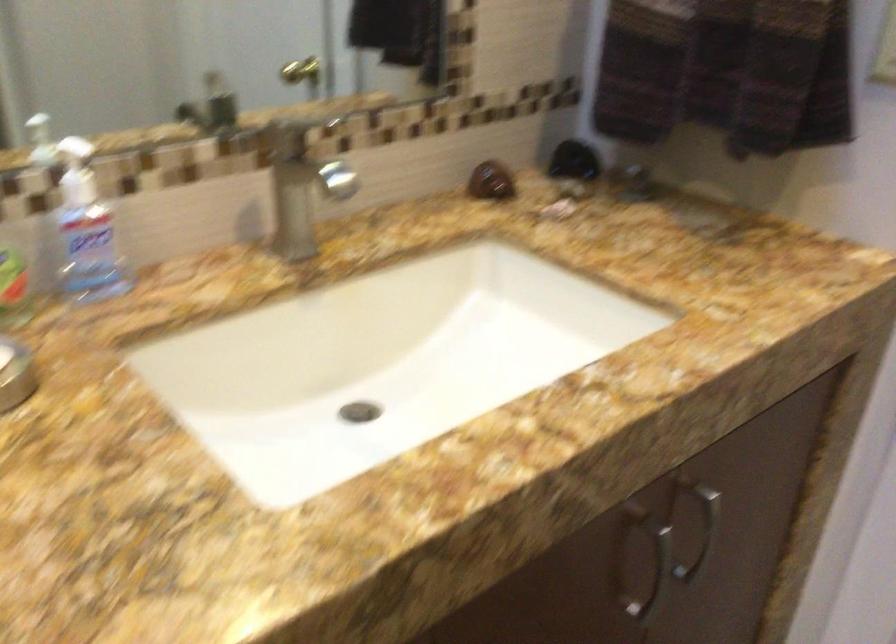
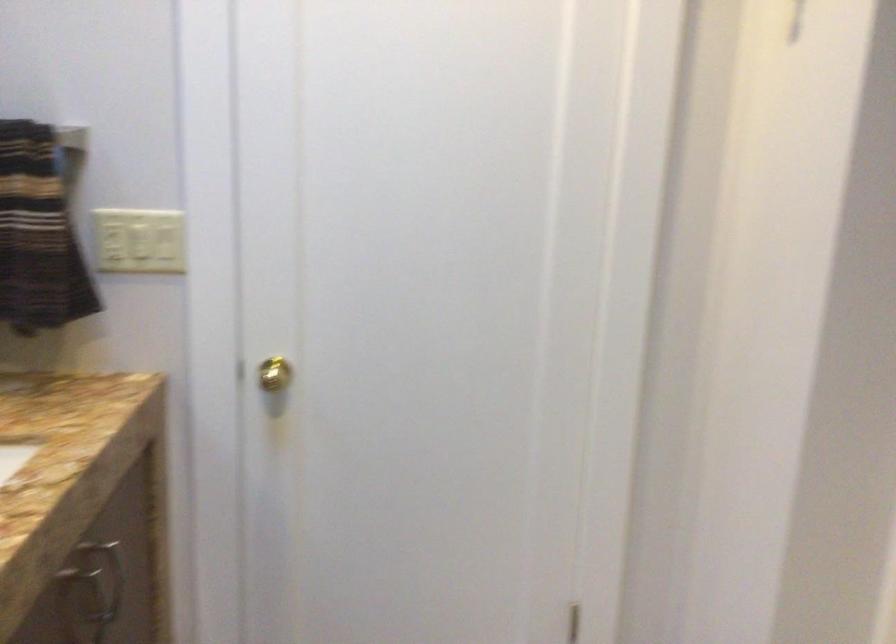
Question: How did the camera likely rotate?

Choices:
 (A) Left
 (B) Right
 (C) Up
 (D) Down

Answer: (B)